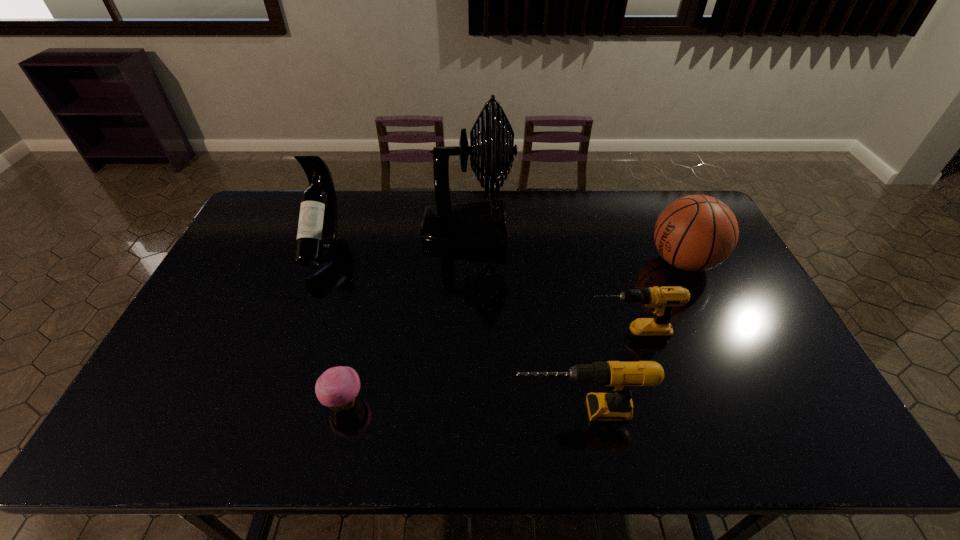
Identify the location of vacant space located 0.060m on the front of the fifth object from right to left. The height and width of the screenshot is (540, 960). (334, 446).

Find the location of a particular element. fan positioned at the far edge is located at coordinates (481, 226).

The image size is (960, 540). Identify the location of wine bottle at the far edge. (317, 230).

Locate an element on the screen. The image size is (960, 540). drill that is at the near edge is located at coordinates (618, 376).

The image size is (960, 540). In order to click on cupcake that is positioned at the near edge in this screenshot , I will do `click(337, 388)`.

Locate an element on the screen. The height and width of the screenshot is (540, 960). object that is at the right edge is located at coordinates (694, 233).

In the image, there is a desktop. Where is `free space at the far edge`? This screenshot has height=540, width=960. free space at the far edge is located at coordinates (592, 198).

At what (x,y) coordinates should I click in order to perform the action: click on vacant region at the right edge of the desktop. Please return your answer as a coordinate pair (x, y). Looking at the image, I should click on (760, 326).

In the image, there is a desktop. Identify the location of blank space at the near right corner. (778, 429).

Locate an element on the screen. The width and height of the screenshot is (960, 540). free area in between the leftmost object and the nearer drill is located at coordinates (451, 328).